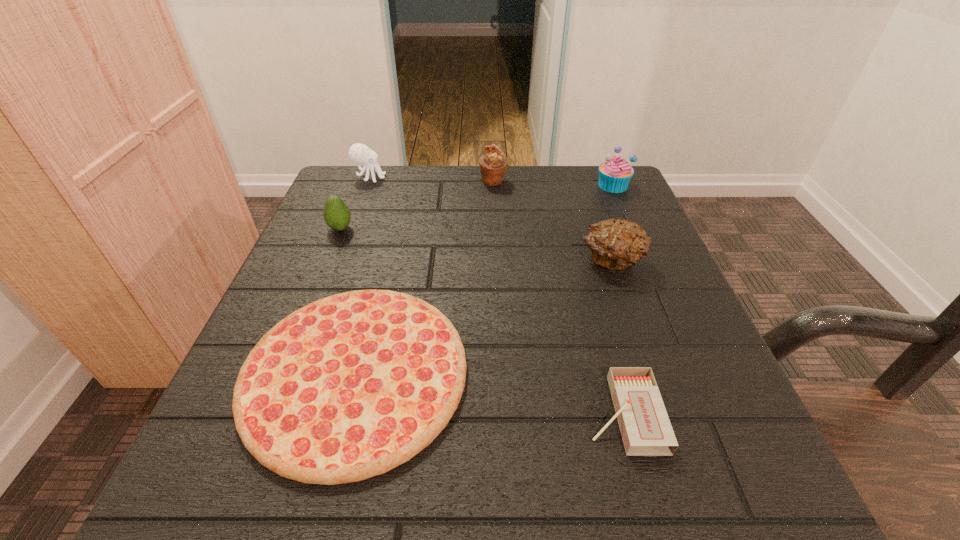
Find the location of a particular element. vacant region at the near left corner of the desktop is located at coordinates (204, 489).

The width and height of the screenshot is (960, 540). In the image, there is a desktop. Find the location of `free space at the far right corner`. free space at the far right corner is located at coordinates (x=594, y=191).

The width and height of the screenshot is (960, 540). In the image, there is a desktop. Find the location of `vacant space at the near right corner`. vacant space at the near right corner is located at coordinates (709, 455).

Locate an element on the screen. empty location between the octopus and the second shortest object is located at coordinates (496, 295).

The image size is (960, 540). Find the location of `free area in between the fourth nearest object and the fifth farthest object`. free area in between the fourth nearest object and the fifth farthest object is located at coordinates (476, 245).

The width and height of the screenshot is (960, 540). Find the location of `vacant area between the fourth farthest object and the octopus`. vacant area between the fourth farthest object and the octopus is located at coordinates (355, 203).

The height and width of the screenshot is (540, 960). I want to click on vacant region between the third nearest object and the octopus, so click(491, 219).

Find the location of a particular element. vacant space that is in between the octopus and the nearest muffin is located at coordinates (491, 219).

Identify the location of vacant area between the octopus and the shortest object. (363, 275).

What are the coordinates of `free spot between the octopus and the avocado` in the screenshot? It's located at (355, 203).